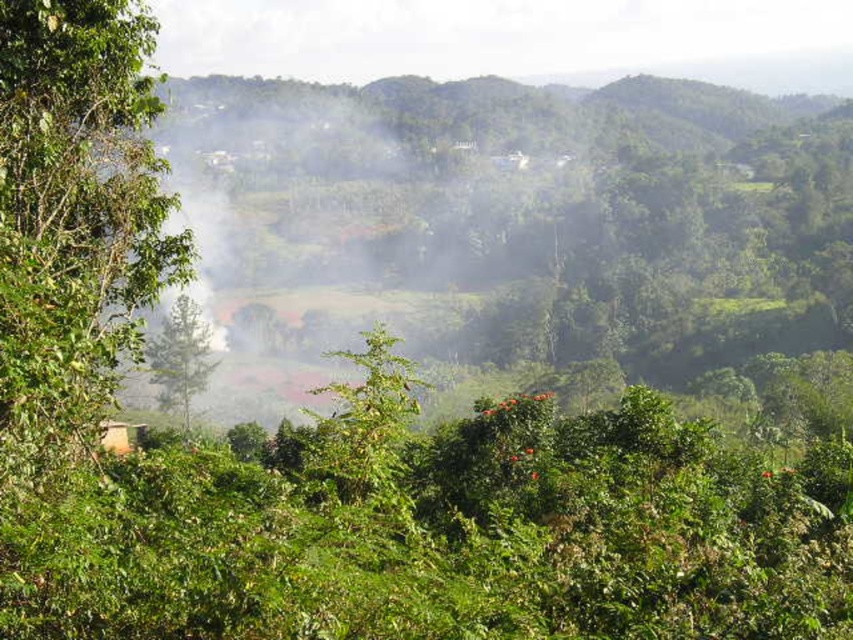
Where is `green matte tree at center`? Image resolution: width=853 pixels, height=640 pixels. green matte tree at center is located at coordinates (180, 356).

The width and height of the screenshot is (853, 640). I want to click on green matte tree at center, so click(180, 356).

Between green leafy tree at left and wooden hut at lower left, which one has less height?

wooden hut at lower left

Is point (7, 296) less distant than point (105, 451)?

That is True.

What do you see at coordinates (74, 220) in the screenshot?
I see `green leafy tree at left` at bounding box center [74, 220].

Where is `green leafy tree at left`? green leafy tree at left is located at coordinates (74, 220).

Identify the location of green leafy tree at left. Image resolution: width=853 pixels, height=640 pixels. (74, 220).

Who is positioned more to the left, green leafy tree at left or green matte tree at center?

green matte tree at center is more to the left.

Between point (30, 237) and point (169, 332), which one is positioned in front?

Point (30, 237)

Identify the location of green leafy tree at left. The width and height of the screenshot is (853, 640). (74, 220).